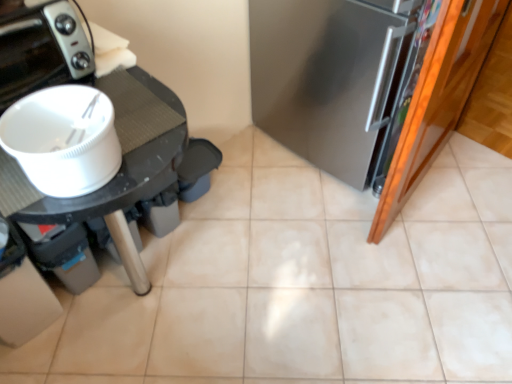
Find the location of `vacant space situated above beige ceramic tile at center (from a real-world perspective)`. vacant space situated above beige ceramic tile at center (from a real-world perspective) is located at coordinates (289, 284).